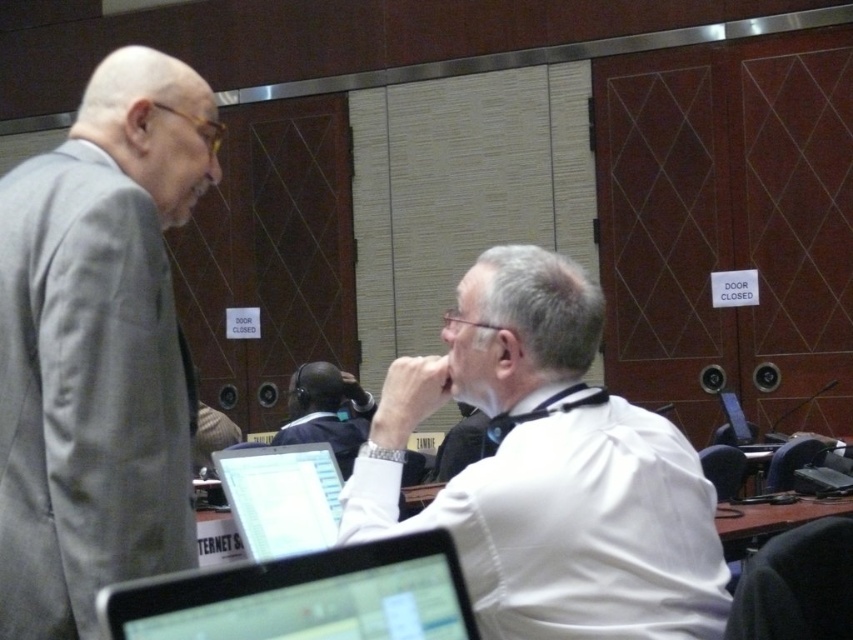
Question: Estimate the real-world distances between objects in this image. Which object is farther from the matte black computer screen at center?

Choices:
 (A) matte black laptop at lower center
 (B) dark blue shirt at center

Answer: (B)

Question: Is white shirt at center bigger than matte black computer screen at center?

Choices:
 (A) no
 (B) yes

Answer: (B)

Question: Which of the following is the closest to the observer?

Choices:
 (A) (682, 449)
 (B) (144, 81)
 (C) (287, 442)

Answer: (A)

Question: In this image, where is gray suit at left located relative to matte black laptop at lower center?

Choices:
 (A) right
 (B) left

Answer: (B)

Question: Which of the following is the farthest from the observer?

Choices:
 (A) dark blue shirt at center
 (B) white shirt at center
 (C) matte black laptop at lower center
 (D) gray suit at left

Answer: (A)

Question: Is white shirt at center smaller than dark blue shirt at center?

Choices:
 (A) no
 (B) yes

Answer: (A)